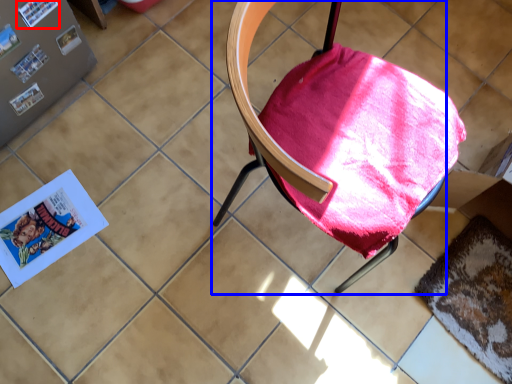
Question: Among these objects, which one is nearest to the camera, paperback book (highlighted by a red box) or chair (highlighted by a blue box)?

Choices:
 (A) paperback book
 (B) chair

Answer: (B)